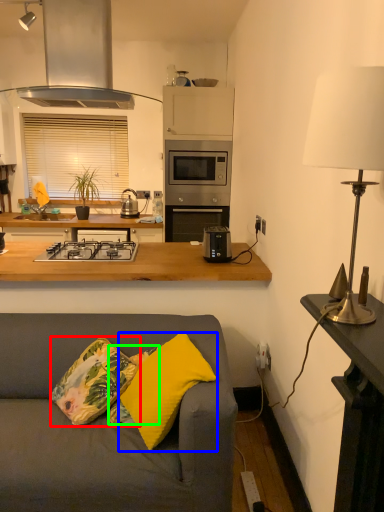
Question: Considering the real-world distances, which object is closest to throw pillow (highlighted by a red box)? pillow (highlighted by a blue box) or pillow (highlighted by a green box).

Choices:
 (A) pillow
 (B) pillow

Answer: (B)